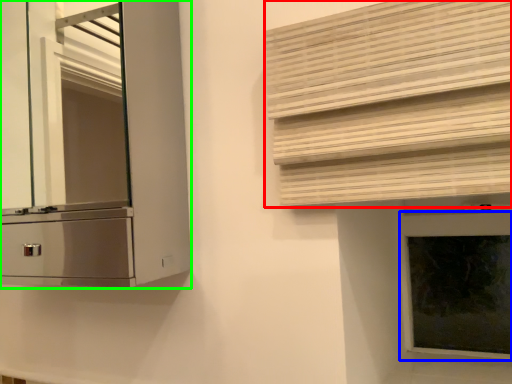
Question: Which object is positioned farthest from shutter (highlighted by a red box)? Select from window frame (highlighted by a blue box) and cabinetry (highlighted by a green box).

Choices:
 (A) window frame
 (B) cabinetry

Answer: (B)